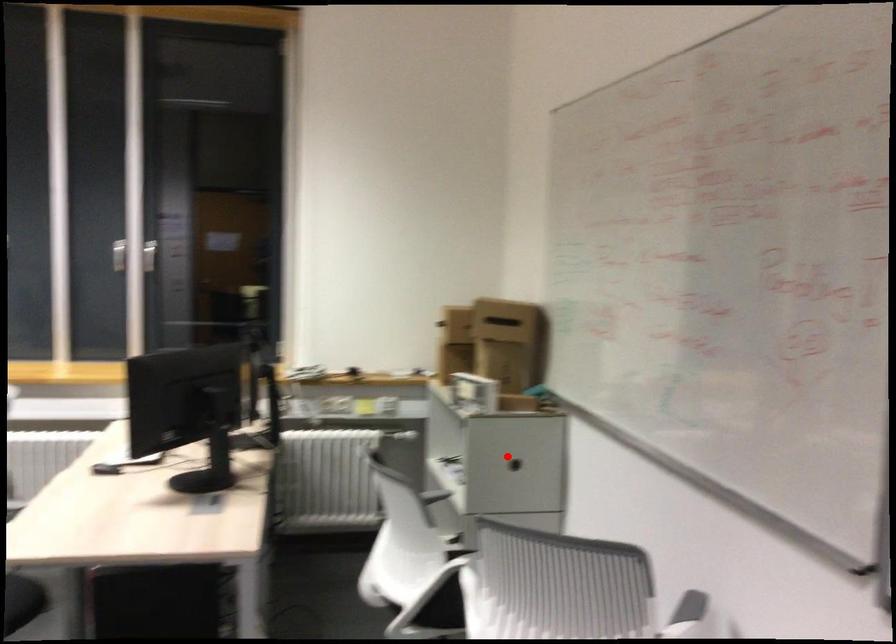
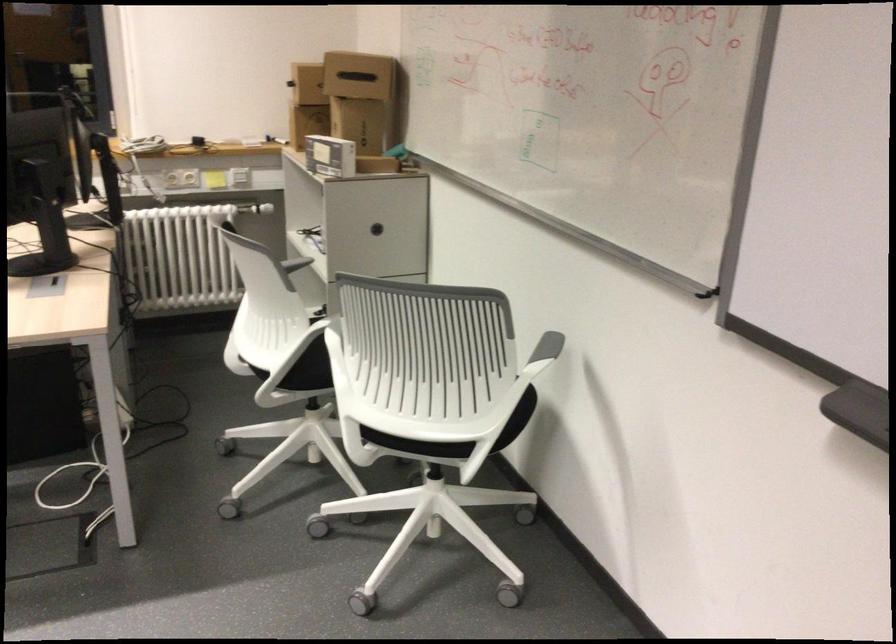
Where in the second image is the point corresponding to the highlighted location from the first image?

(375, 229)